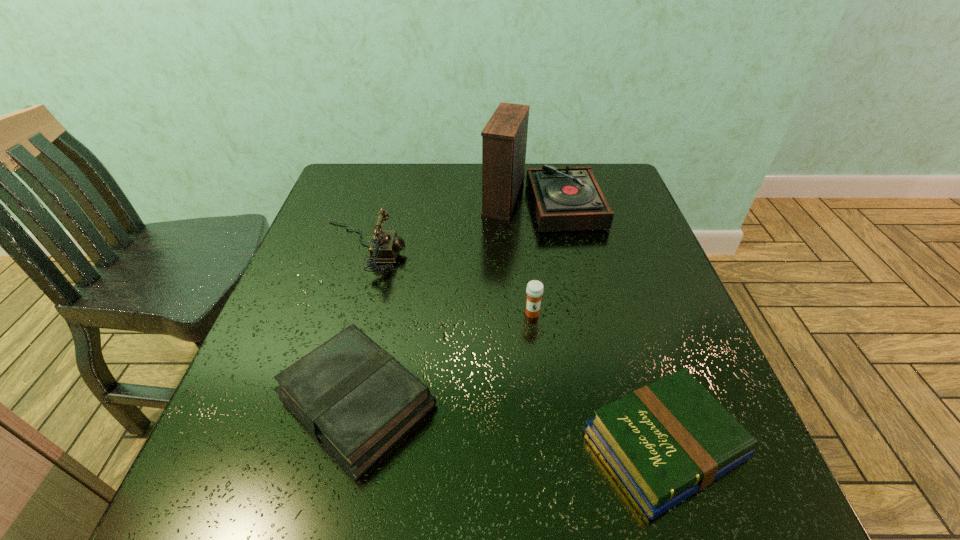
The width and height of the screenshot is (960, 540). In order to click on free point that satisfies the following two spatial constraints: 1. on the front side of the right book; 2. on the right side of the left book in this screenshot , I will do `click(348, 444)`.

The image size is (960, 540). Find the location of `free location that satisfies the following two spatial constraints: 1. on the dial of the fourth shortest object; 2. on the left side of the right book`. free location that satisfies the following two spatial constraints: 1. on the dial of the fourth shortest object; 2. on the left side of the right book is located at coordinates (302, 444).

At what (x,y) coordinates should I click in order to perform the action: click on vacant area in the image that satisfies the following two spatial constraints: 1. on the back side of the left book; 2. on the right side of the tallest object. Please return your answer as a coordinate pair (x, y). Looking at the image, I should click on (403, 200).

Where is `vacant space that satisfies the following two spatial constraints: 1. on the label side of the right book; 2. on the right side of the medicine`? Image resolution: width=960 pixels, height=540 pixels. vacant space that satisfies the following two spatial constraints: 1. on the label side of the right book; 2. on the right side of the medicine is located at coordinates (547, 444).

The width and height of the screenshot is (960, 540). I want to click on blank area in the image that satisfies the following two spatial constraints: 1. on the back side of the left book; 2. on the dial of the telephone, so click(x=393, y=247).